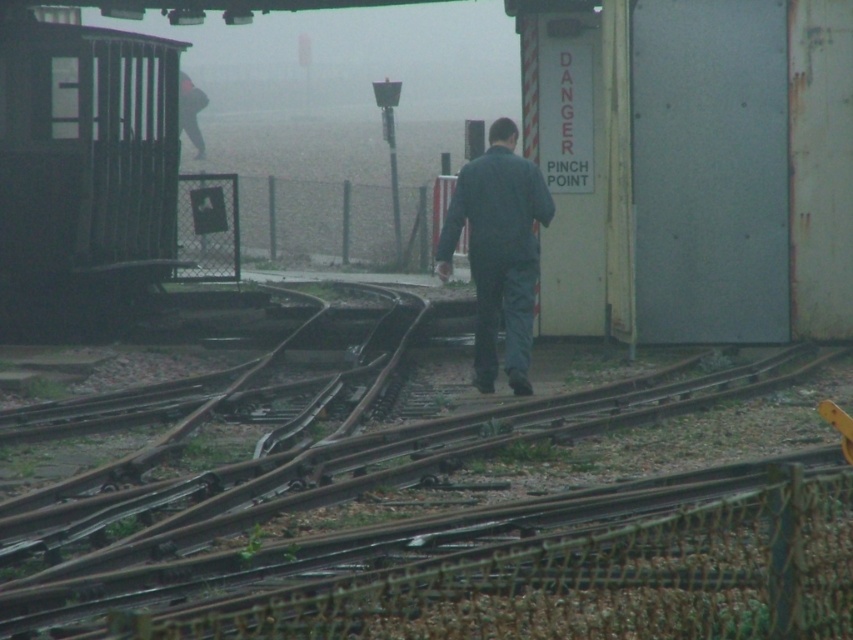
Question: Does rusty metal tracks at center have a larger size compared to dark blue fabric at center?

Choices:
 (A) yes
 (B) no

Answer: (A)

Question: Can you confirm if dark gray metal train at left is thinner than dark blue fabric at center?

Choices:
 (A) no
 (B) yes

Answer: (B)

Question: Which point is closer to the camera taking this photo?

Choices:
 (A) (158, 228)
 (B) (492, 316)
 (C) (741, 397)

Answer: (C)

Question: Which object is farther from the camera taking this photo?

Choices:
 (A) dark gray metal train at left
 (B) rusty metal tracks at center

Answer: (A)

Question: Does rusty metal tracks at center appear under dark gray metal train at left?

Choices:
 (A) no
 (B) yes

Answer: (B)

Question: Which object is farther from the camera taking this photo?

Choices:
 (A) dark blue fabric at center
 (B) rusty metal tracks at center
 (C) dark gray metal train at left

Answer: (C)